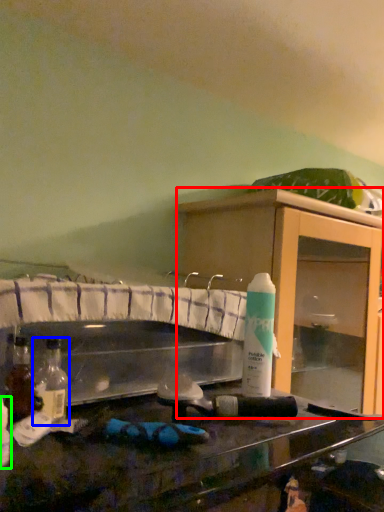
Question: Which is farther away from cabinetry (highlighted by a red box)? bottle (highlighted by a blue box) or bottle (highlighted by a green box)?

Choices:
 (A) bottle
 (B) bottle

Answer: (B)